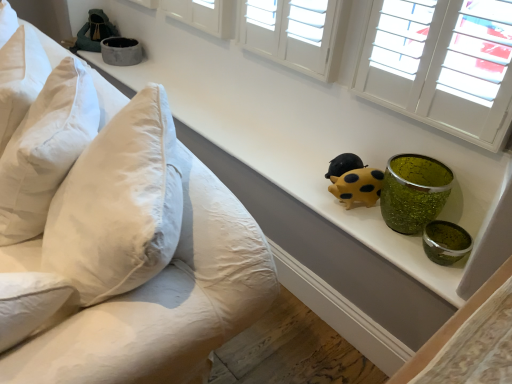
This screenshot has height=384, width=512. Identify the location of free spot to the left of yellow matte pig at center, positioned as the first toy in right-to-left order. [x=308, y=186].